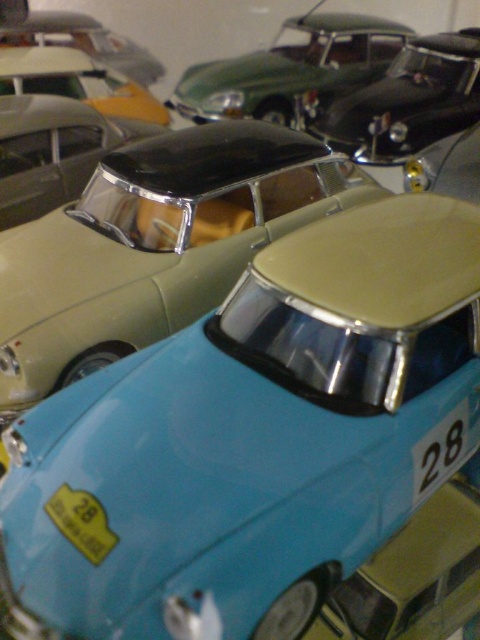
Question: Which of the following is the farthest from the observer?

Choices:
 (A) (162, 180)
 (B) (290, 72)

Answer: (B)

Question: Estimate the real-world distances between objects in this image. Which object is farther from the metallic green car at upper center?

Choices:
 (A) light blue plastic car at center
 (B) light blue glossy car at center

Answer: (B)

Question: Can you confirm if light blue plastic car at center is positioned below metallic green car at upper center?

Choices:
 (A) no
 (B) yes

Answer: (B)

Question: Can you confirm if light blue glossy car at center is positioned above light blue plastic car at center?

Choices:
 (A) no
 (B) yes

Answer: (A)

Question: Estimate the real-world distances between objects in this image. Which object is farther from the metallic green car at upper center?

Choices:
 (A) light blue plastic car at center
 (B) light blue glossy car at center

Answer: (B)

Question: Can you confirm if light blue glossy car at center is positioned below light blue plastic car at center?

Choices:
 (A) no
 (B) yes

Answer: (B)